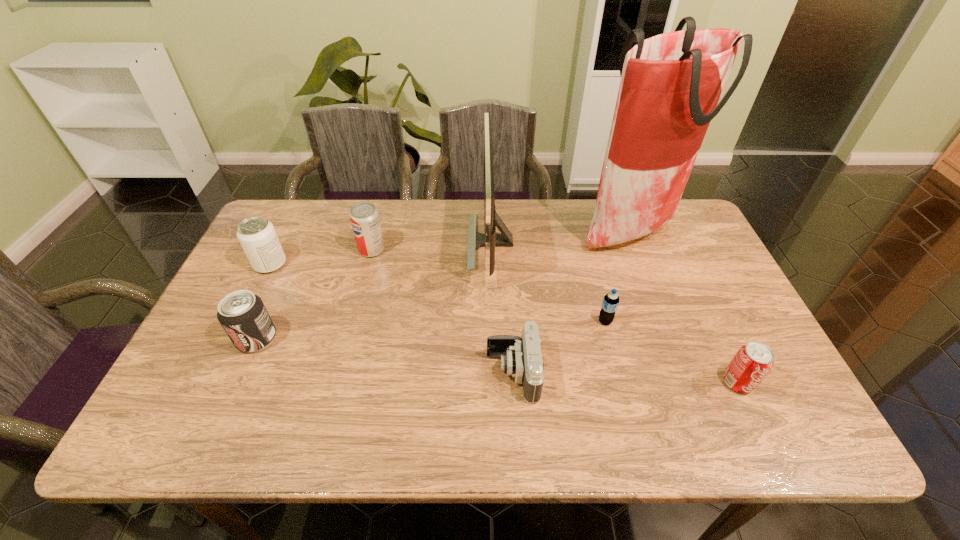
This screenshot has height=540, width=960. Find the location of `grocery bag`. grocery bag is located at coordinates (671, 83).

Find the location of `monitor`. monitor is located at coordinates (489, 240).

Identify the location of the sixth object from right to left. This screenshot has width=960, height=540. (364, 217).

Find the location of `the nearest soda bottle`. the nearest soda bottle is located at coordinates (750, 365).

Locate an element on the screen. This screenshot has width=960, height=540. the second soda bottle from right to left is located at coordinates (610, 303).

I want to click on camera, so click(521, 357).

Where is `vacant space situated on the front of the grocery bag`? The width and height of the screenshot is (960, 540). vacant space situated on the front of the grocery bag is located at coordinates (658, 297).

Locate an element on the screen. The height and width of the screenshot is (540, 960). vacant space located 0.050m on the screen side of the seventh shortest object is located at coordinates [x=452, y=242].

The image size is (960, 540). What are the coordinates of `free space located on the screen side of the seventh shortest object` in the screenshot? It's located at (443, 242).

I want to click on vacant region located 0.380m on the screen side of the seventh shortest object, so click(347, 242).